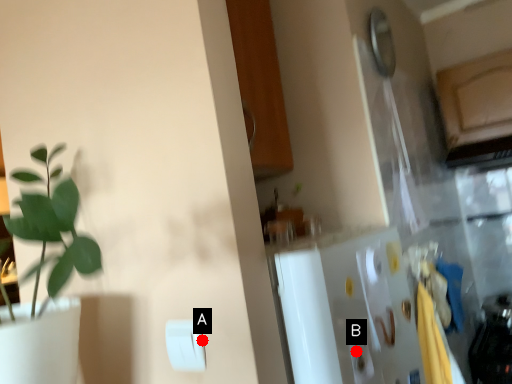
Question: Two points are circled on the image, labeled by A and B beside each circle. Among these points, which one is nearest to the camera?

Choices:
 (A) A is closer
 (B) B is closer

Answer: (A)